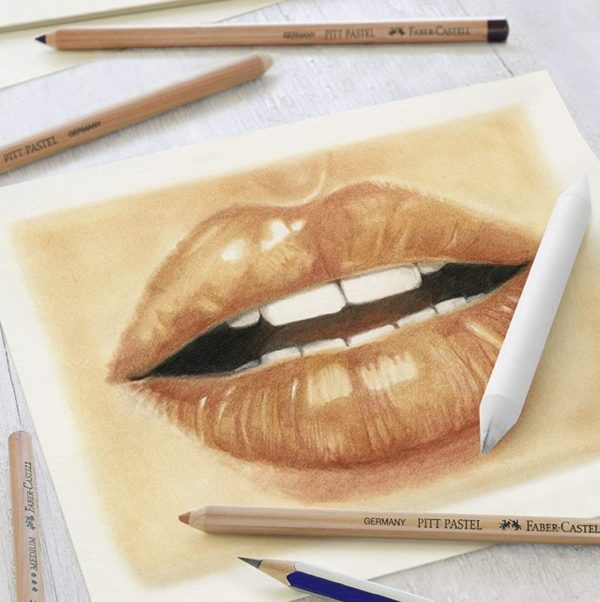
At what (x,y) coordinates should I click in order to perform the action: click on table. Please return your answer as a coordinate pair (x, y). This screenshot has width=600, height=602. Looking at the image, I should click on (290, 108).